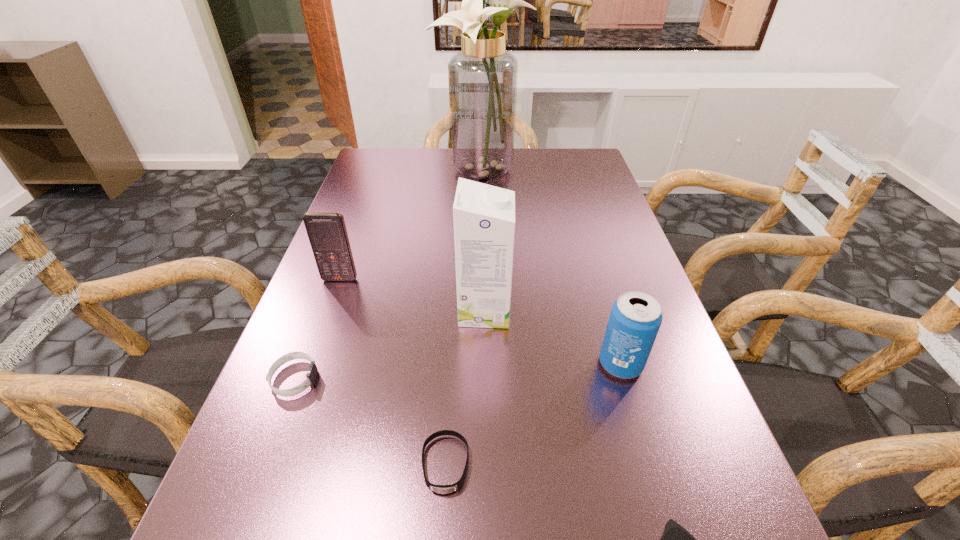
Locate an element on the screen. The height and width of the screenshot is (540, 960). free region located on the right of the flower arrangement is located at coordinates (596, 168).

Identify the location of blank space located on the back of the second tallest object. pos(484,196).

You are a GUI agent. You are given a task and a screenshot of the screen. Output one action in this format:
    pyautogui.click(x=<x>, y=<y>)
    Task: Click on the vacant space located 0.180m on the screen of the second farthest object
    This screenshot has width=960, height=540.
    Given the screenshot: What is the action you would take?
    pyautogui.click(x=316, y=346)

The width and height of the screenshot is (960, 540). I want to click on free space located on the left of the soda can, so click(x=411, y=364).

The image size is (960, 540). Find the location of `vacant space situated 0.220m on the outer surface of the taller wristband`. vacant space situated 0.220m on the outer surface of the taller wristband is located at coordinates (442, 379).

Locate an element on the screen. object at the far edge is located at coordinates (483, 76).

Locate an element on the screen. The height and width of the screenshot is (540, 960). cellular telephone at the left edge is located at coordinates (327, 233).

Where is `wristband present at the left edge`? wristband present at the left edge is located at coordinates (312, 372).

At what (x,y) coordinates should I click in order to perform the action: click on object that is at the right edge. Please return your answer as a coordinate pair (x, y). This screenshot has width=960, height=540. Looking at the image, I should click on (635, 318).

This screenshot has width=960, height=540. In the image, there is a desktop. In order to click on vacant space at the left edge in this screenshot , I will do `click(391, 187)`.